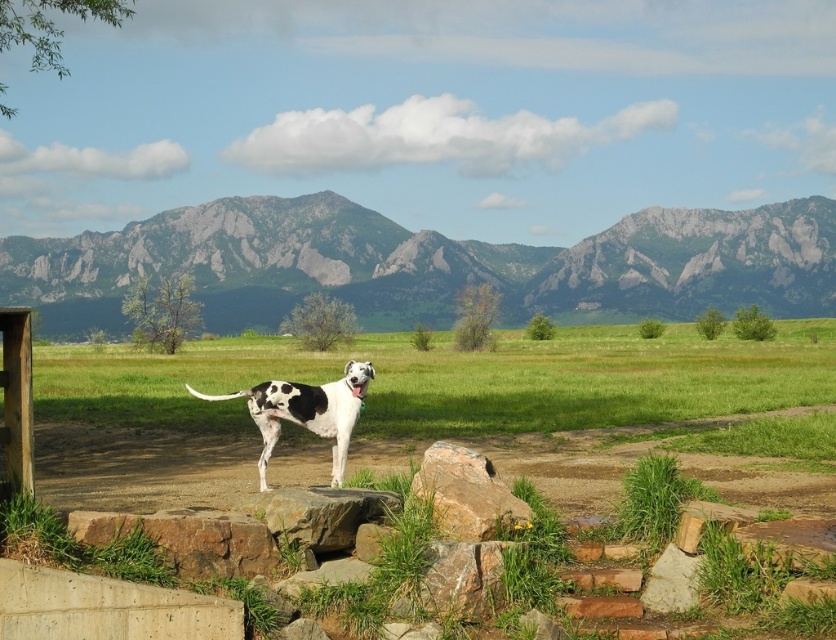
I want to click on brown rough rock at center, so click(467, 493).

From the picture: Which of these two, brown rough rock at center or smooth gray rock at center, stands taller?

Standing taller between the two is brown rough rock at center.

Locate an element on the screen. This screenshot has height=640, width=836. brown rough rock at center is located at coordinates (467, 493).

Can you confirm if gray rocky mountain at upper center is positioned to the left of brown rough rock at center?

Correct, you'll find gray rocky mountain at upper center to the left of brown rough rock at center.

Does point (712, 211) lie in front of point (488, 476)?

No, it is not.

Is point (370, 301) more distant than point (520, 502)?

That is True.

This screenshot has width=836, height=640. Find the location of `gray rocky mountain at upper center`. gray rocky mountain at upper center is located at coordinates (427, 264).

Between brown rough stone at lower center and brown rough rock at center, which one is positioned higher?

brown rough rock at center is above.

Can you confirm if brown rough stone at lower center is thinner than brown rough rock at center?

In fact, brown rough stone at lower center might be wider than brown rough rock at center.

Identify the location of brown rough stone at lower center. (187, 538).

Locate an element on the screen. brown rough stone at lower center is located at coordinates (187, 538).